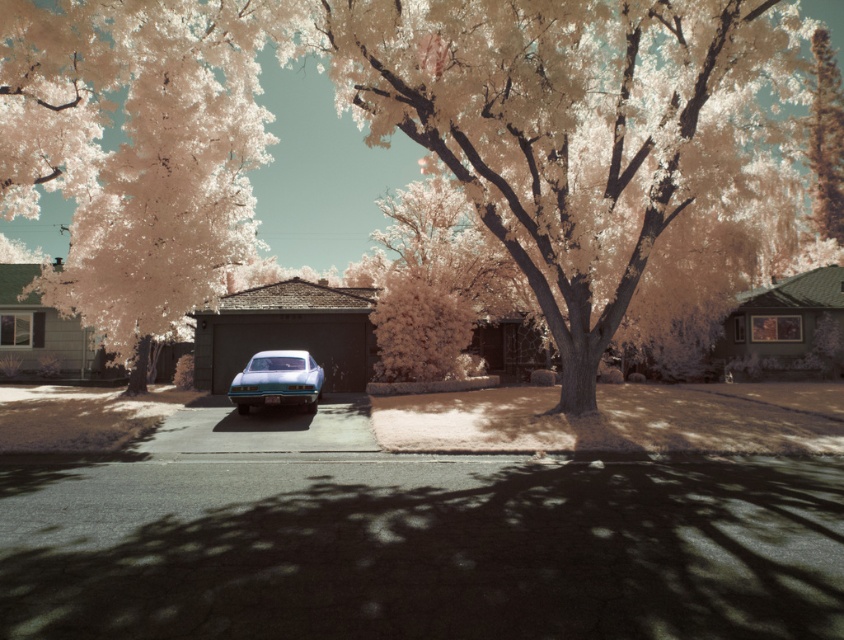
Is matte gray garage at left smaller than metallic blue car at center?

Yes.

Does point (38, 316) lie behind point (245, 369)?

Yes, it is.

Image resolution: width=844 pixels, height=640 pixels. Identify the location of matte gray garage at left. (41, 326).

Who is shorter, translucent pink foliage at left or dark brown wooden garage at right?

Standing shorter between the two is dark brown wooden garage at right.

At what (x,y) coordinates should I click in order to perform the action: click on translucent pink foliage at left. Please return your answer as a coordinate pair (x, y). This screenshot has width=844, height=640. Looking at the image, I should click on (136, 148).

Does matte blue car at center have a lesser height compared to dark brown wooden garage at right?

Yes.

Can you confirm if matte blue car at center is wider than dark brown wooden garage at right?

No.

Locate an element on the screen. matte blue car at center is located at coordinates (287, 332).